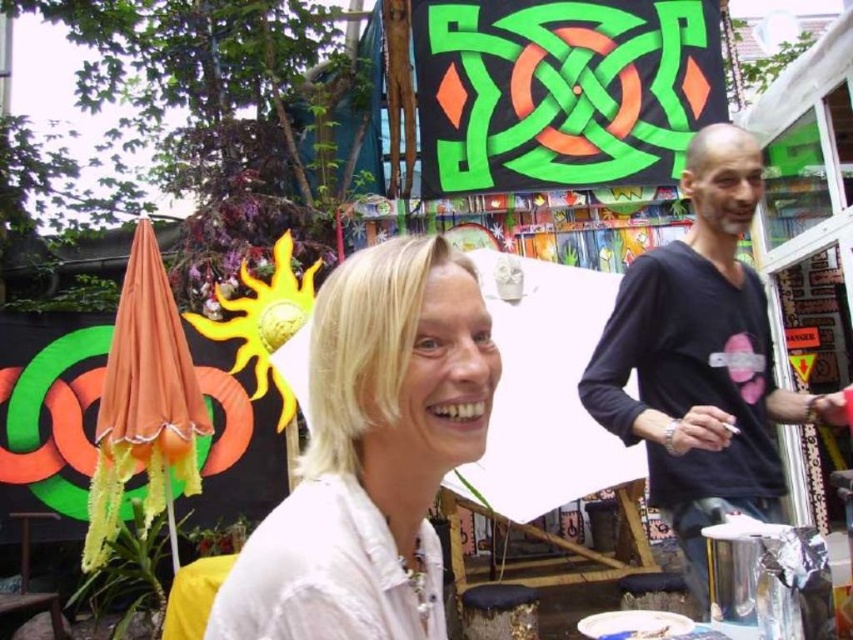
Is point (421, 508) farther from camera compared to point (724, 257)?

No, it is not.

At what (x,y) coordinates should I click in order to perform the action: click on white matte shirt at center. Please return your answer as a coordinate pair (x, y). This screenshot has height=640, width=853. Looking at the image, I should click on [x=370, y=452].

Locate an element on the screen. Image resolution: width=853 pixels, height=640 pixels. white matte shirt at center is located at coordinates (370, 452).